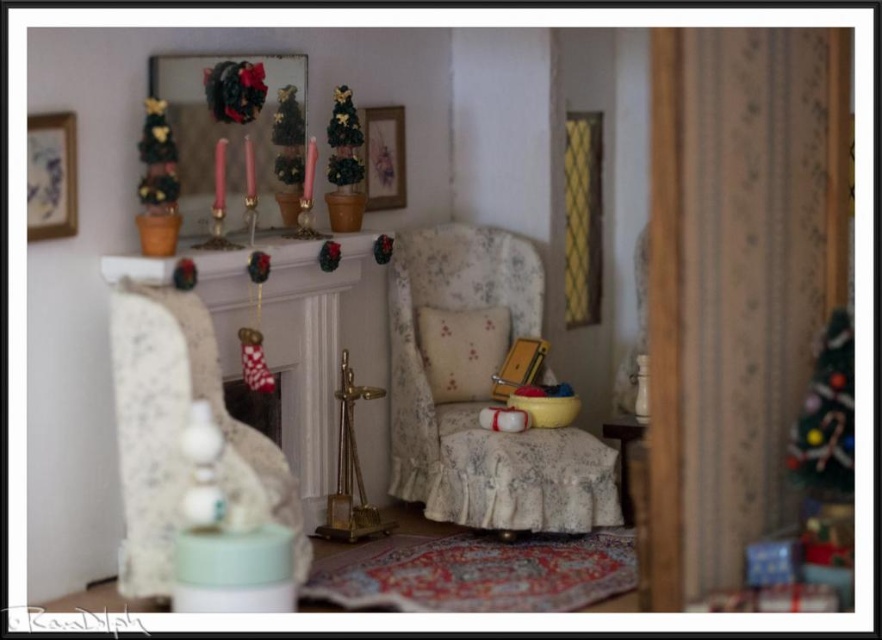
You are navigating a tiny toy car through the dollhouse living room. You need to move from the first point to the second point. Can you safely drive straight from point (75, 116) to point (400, 180) without any obstacles blocking your path?

Point (75, 116) is in front of point (400, 180), so the path between them is clear. Yes, you can safely drive straight from point (75, 116) to point (400, 180) without any obstacles blocking your path.

You are a small toy mouse navigating through the dollhouse living room. You need to move from the blue paper picture frame at upper left to the matte gold picture frame at upper center. Given that your maximum jump distance is 1 meter, can you make the jump between them?

The distance between the blue paper picture frame at upper left and the matte gold picture frame at upper center is 99.64 centimeters. Since your maximum jump distance is 1 meter, you can just barely make the jump between them.

Looking at this image, you are a small toy that needs to be placed on the highest object in the scene. Which object should you choose between the floral fabric stool at center and the matte gold picture frame at upper center?

The matte gold picture frame at upper center is taller than the floral fabric stool at center, so you should place the toy on the matte gold picture frame at upper center.